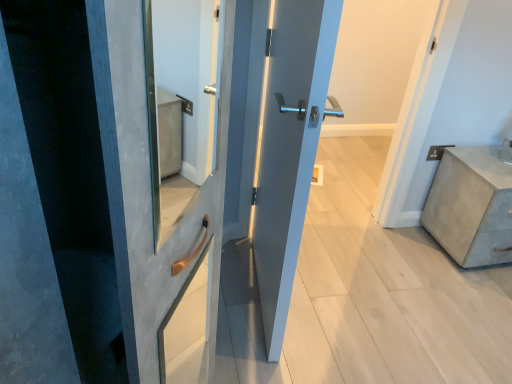
Where is `vacant area that lies between concrete textured chest of drawers at right and satin blue door at center`? The image size is (512, 384). vacant area that lies between concrete textured chest of drawers at right and satin blue door at center is located at coordinates (377, 283).